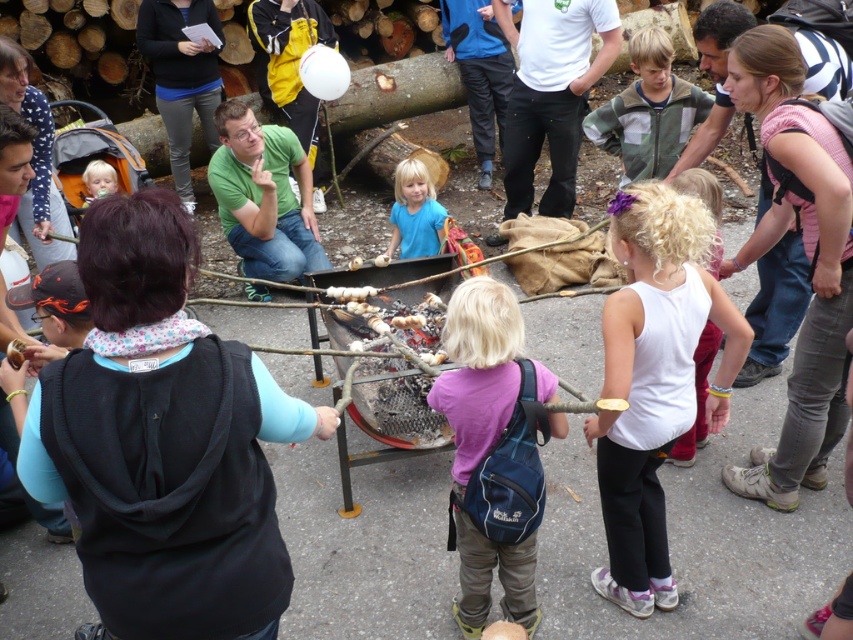
Is point (479, 276) farther from camera compared to point (91, 168)?

No, it is not.

Is purple fabric backpack at center taller than light blue fabric at center?

Yes, purple fabric backpack at center is taller than light blue fabric at center.

Is point (463, 541) positioned after point (91, 198)?

That is False.

Locate an element on the screen. The image size is (853, 640). purple fabric backpack at center is located at coordinates [479, 371].

Based on the photo, measure the distance between white cotton tank top at center and purple fabric backpack at center.

A distance of 36.54 centimeters exists between white cotton tank top at center and purple fabric backpack at center.

Image resolution: width=853 pixels, height=640 pixels. I want to click on white cotton tank top at center, so click(653, 380).

Is green fleece jacket at center to the left of blue matte shirt at center from the viewer's perspective?

No, green fleece jacket at center is not to the left of blue matte shirt at center.

Does green fleece jacket at center appear over blue matte shirt at center?

Correct, green fleece jacket at center is located above blue matte shirt at center.

Find the location of a particular element. green fleece jacket at center is located at coordinates (648, 112).

Where is `green fleece jacket at center`? The height and width of the screenshot is (640, 853). green fleece jacket at center is located at coordinates (648, 112).